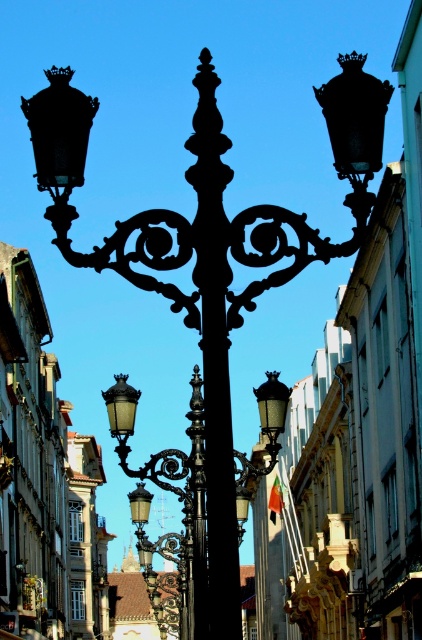
You are standing on the sidewalk and see both the black wrought iron pole at center and the matte black street light at center. Which object is positioned to the right from your perspective?

The black wrought iron pole at center is to the right of the matte black street light at center from your perspective.

You are standing on the street looking at the lamppost and the buildings. There are two points marked in the image. Which point, point (208,74) or point (264,396), is closer to you?

Point (208,74) is closer to the camera than point (264,396).